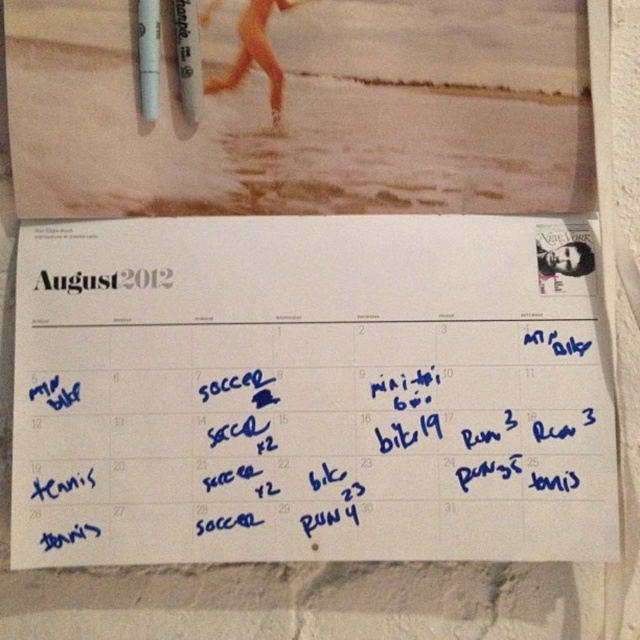
Between point (148, 368) and point (147, 35), which one is positioned in front?

Positioned in front is point (147, 35).

Describe the element at coordinates (310, 392) in the screenshot. The width and height of the screenshot is (640, 640). I see `white paper at center` at that location.

Find the location of `white paper at center`. white paper at center is located at coordinates (310, 392).